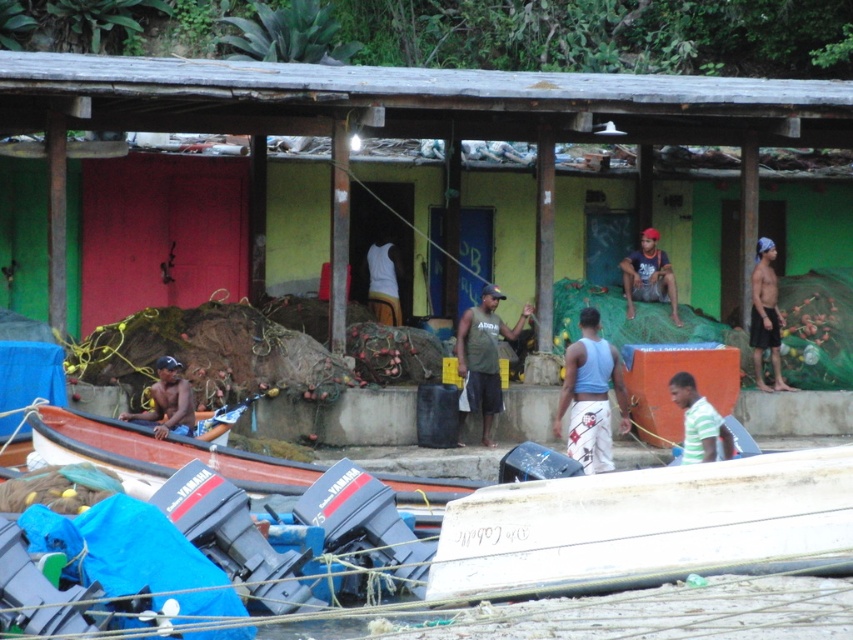
Question: Is green matte tank top at center positioned in front of shiny black shorts at right?

Choices:
 (A) yes
 (B) no

Answer: (A)

Question: Which point is closer to the camera taking this photo?

Choices:
 (A) (704, 458)
 (B) (604, 346)
 (C) (479, 483)

Answer: (A)

Question: Which is nearer to the green striped shirt at lower right?

Choices:
 (A) brown wooden canoe at lower left
 (B) white matte tank top at center
 (C) green matte tank top at center
 (D) white matte boat at lower right

Answer: (D)

Question: Is light blue tank top at center wider than matte blue shorts at center?

Choices:
 (A) no
 (B) yes

Answer: (B)

Question: Which object is farther from the camera taking this photo?

Choices:
 (A) white matte tank top at center
 (B) light blue tank top at center
 (C) white matte boat at lower right
 (D) brown wooden canoe at lower left

Answer: (A)

Question: Can you confirm if brown wooden canoe at lower left is smaller than light blue tank top at center?

Choices:
 (A) yes
 (B) no

Answer: (B)